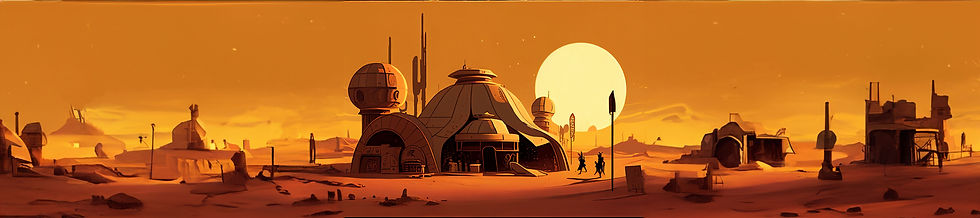
You are a GUI agent. You are given a task and a screenshot of the screen. Output one action in this format:
    pyautogui.click(x=<x>, y=<y>)
    Task: Click on the doorway
    This screenshot has width=980, height=218.
    Given the screenshot: What is the action you would take?
    pyautogui.click(x=488, y=159)